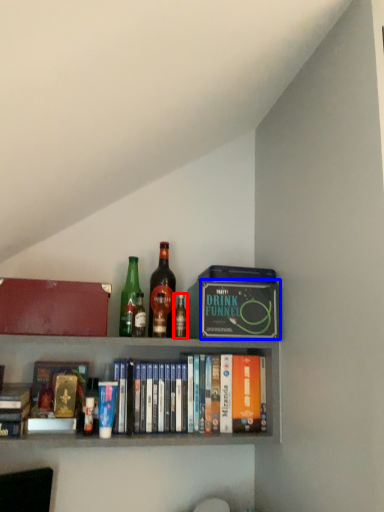
Question: Which of the following is the closest to the observer, bottle (highlighted by a red box) or paperback book (highlighted by a blue box)?

Choices:
 (A) bottle
 (B) paperback book

Answer: (B)